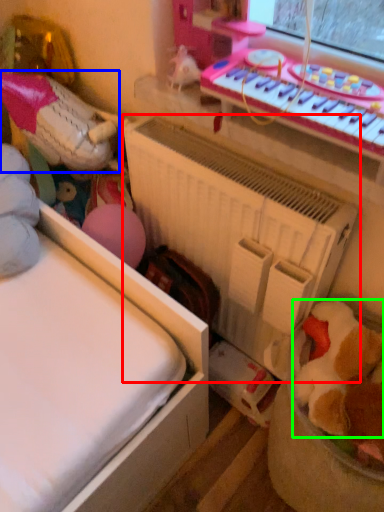
Question: Which object is positioned closest to radiator (highlighted by a red box)? Select from toy (highlighted by a blue box) and toy (highlighted by a green box).

Choices:
 (A) toy
 (B) toy

Answer: (B)